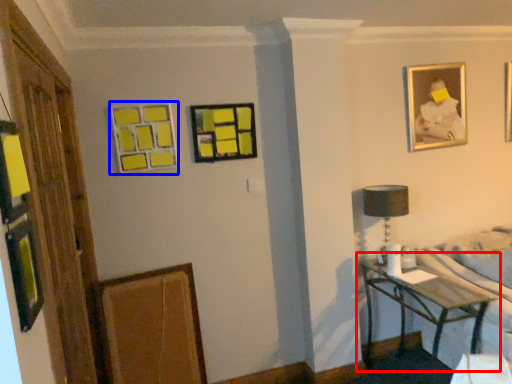
Question: Which of the following is the farthest to the observer, table (highlighted by a red box) or picture frame (highlighted by a blue box)?

Choices:
 (A) table
 (B) picture frame

Answer: (B)